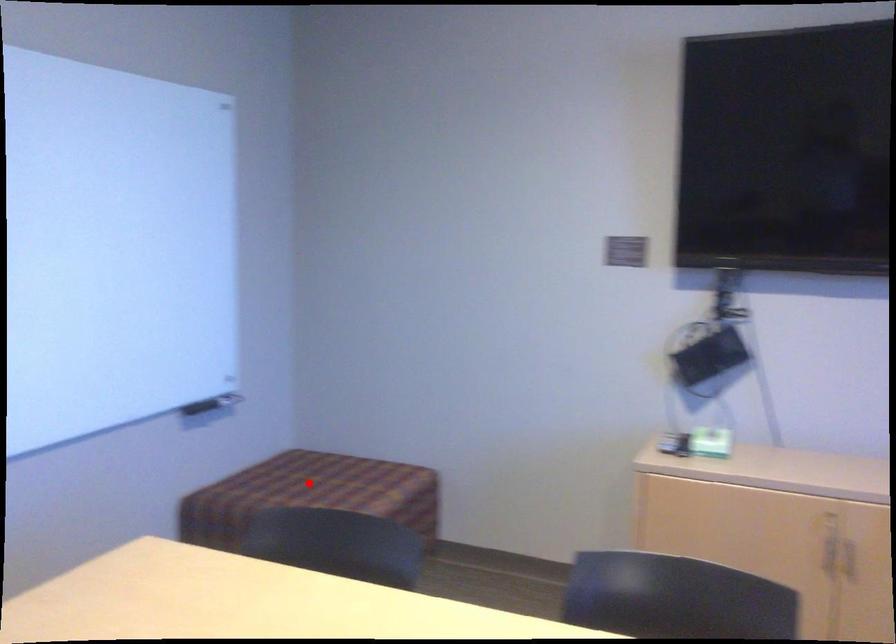
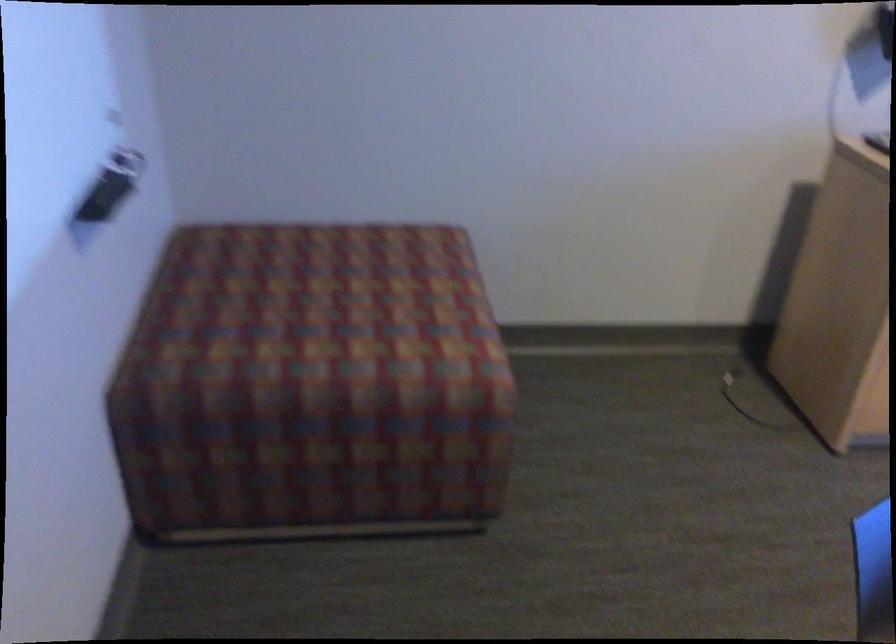
In the second image, find the point that corresponds to the highlighted location in the first image.

(332, 301)